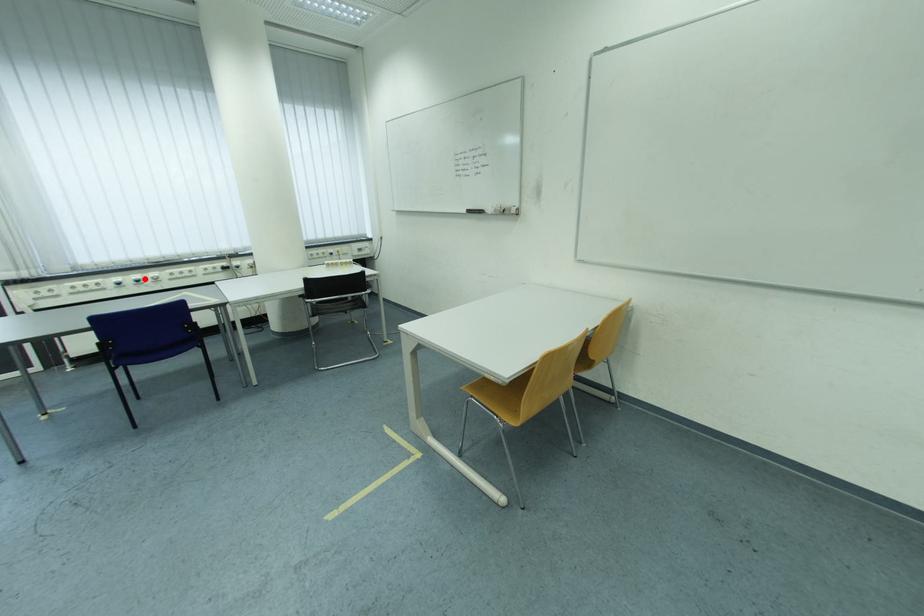
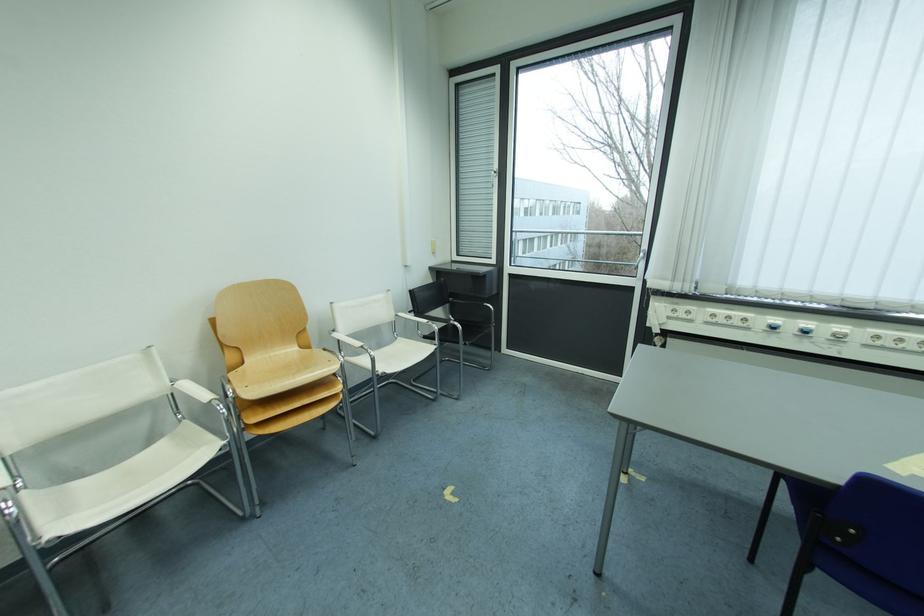
Find the pixel in the second image that matches the highlighted location in the first image.

(816, 326)